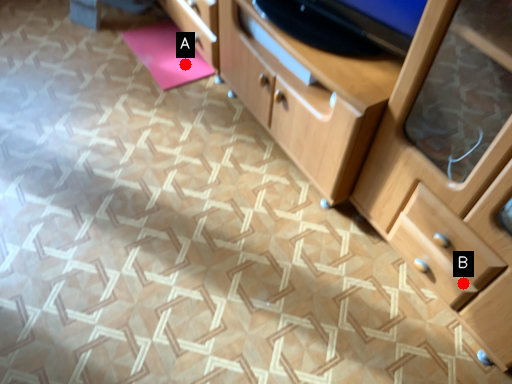
Question: Two points are circled on the image, labeled by A and B beside each circle. Which point is farther from the camera taking this photo?

Choices:
 (A) A is further
 (B) B is further

Answer: (A)